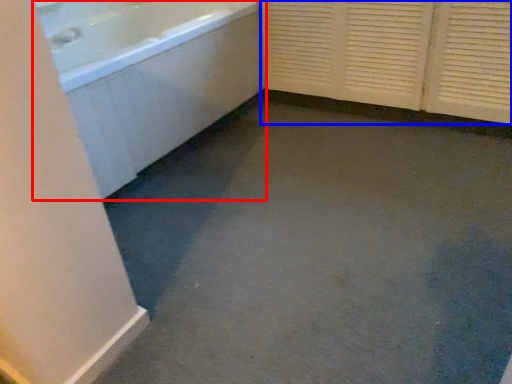
Question: Among these objects, which one is farthest to the camera, bathtub (highlighted by a red box) or screen door (highlighted by a blue box)?

Choices:
 (A) bathtub
 (B) screen door

Answer: (B)